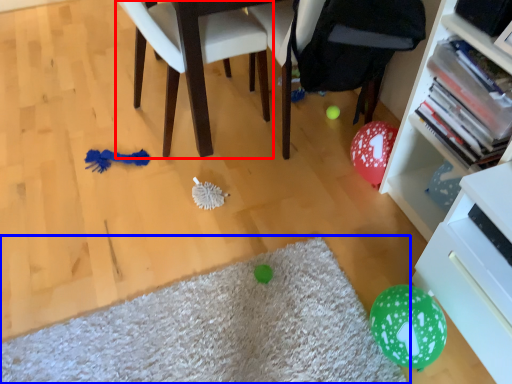
Question: Which object appears farthest to the camera in this image, chair (highlighted by a red box) or mat (highlighted by a blue box)?

Choices:
 (A) chair
 (B) mat

Answer: (A)